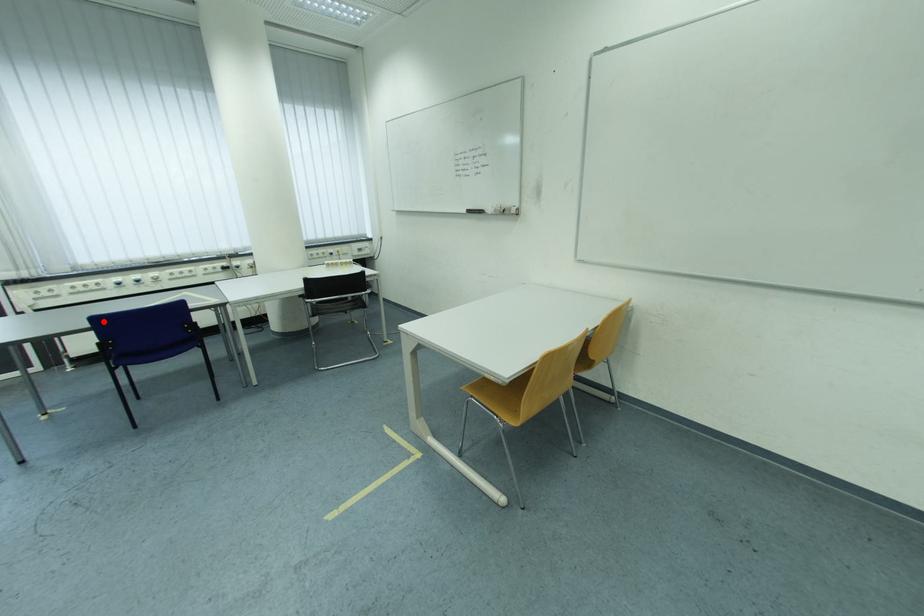
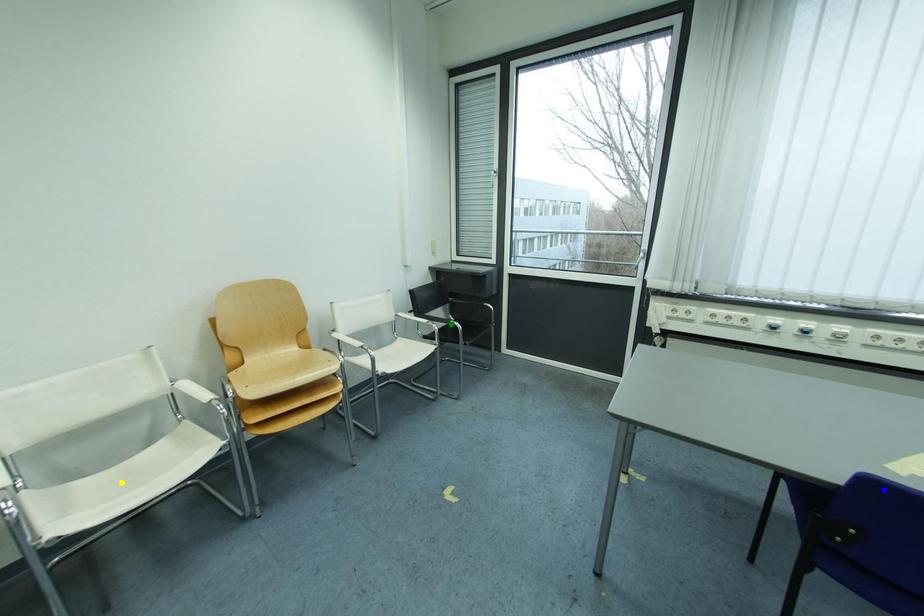
Question: I am providing you with two images of the same scene from different viewpoints. A red point is marked on the first image. You are given multiple points on the second image. Which point in image 2 is actually the same real-world point as the red point in image 1?

Choices:
 (A) yellow point
 (B) blue point
 (C) green point

Answer: (B)